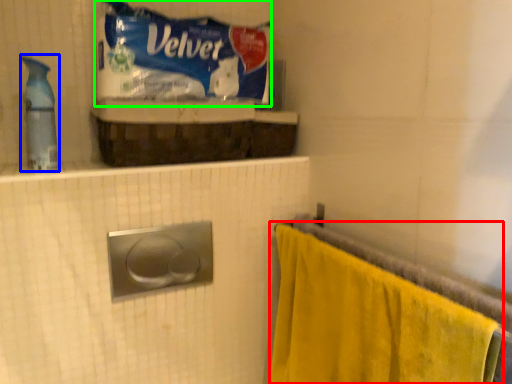
Question: Which object is positioned closest to towel (highlighted by a red box)? Select from cleaning product (highlighted by a blue box) and material (highlighted by a green box).

Choices:
 (A) cleaning product
 (B) material

Answer: (B)